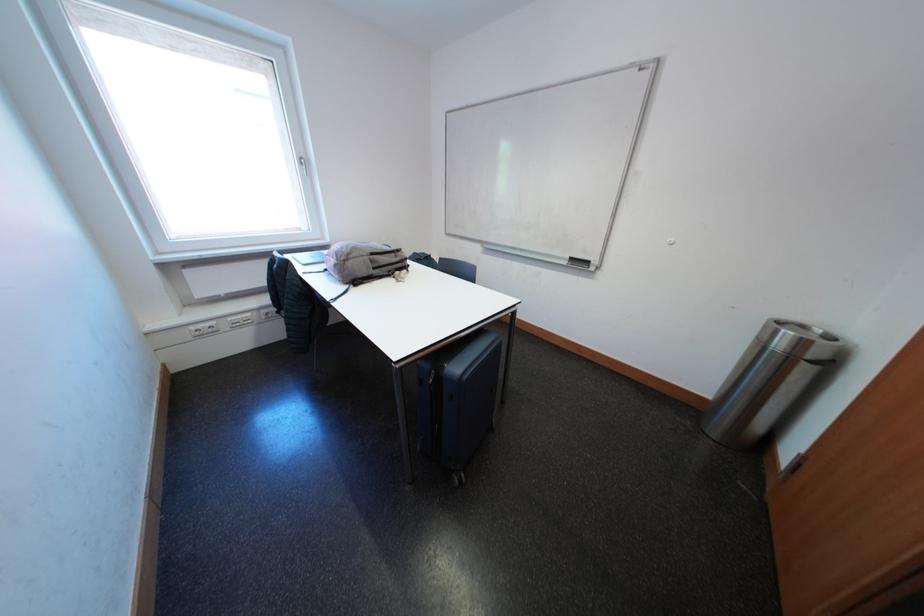
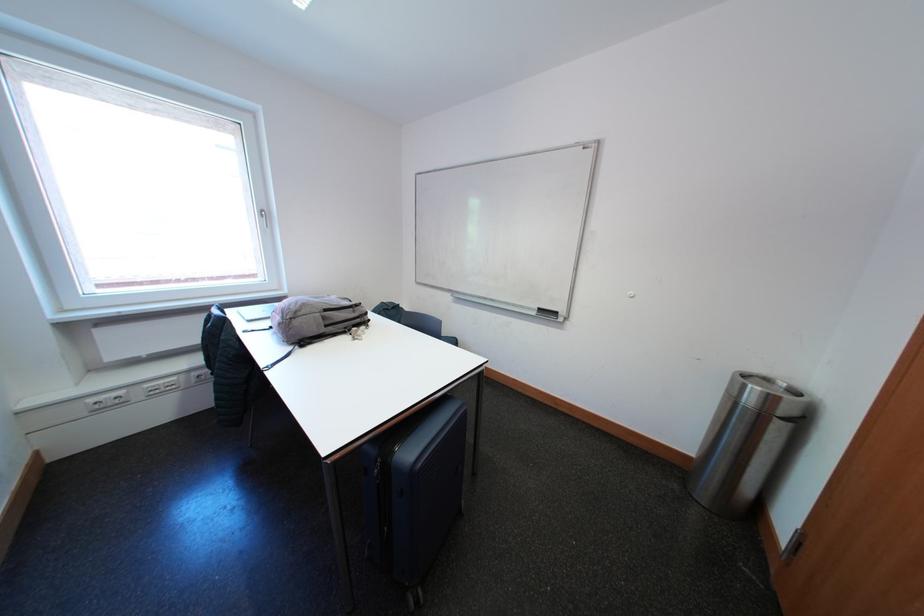
The images are taken continuously from a first-person perspective. In which direction are you moving?

The cameraman walked toward right, forward.